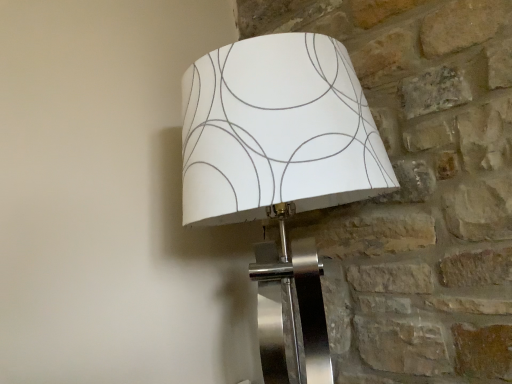
What is the approximate width of white paper lampshade at upper right?

The width of white paper lampshade at upper right is 45.56 centimeters.

The image size is (512, 384). In order to click on white paper lampshade at upper right in this screenshot , I will do tap(280, 170).

What do you see at coordinates (280, 170) in the screenshot? The image size is (512, 384). I see `white paper lampshade at upper right` at bounding box center [280, 170].

Locate an element on the screen. white paper lampshade at upper right is located at coordinates (280, 170).